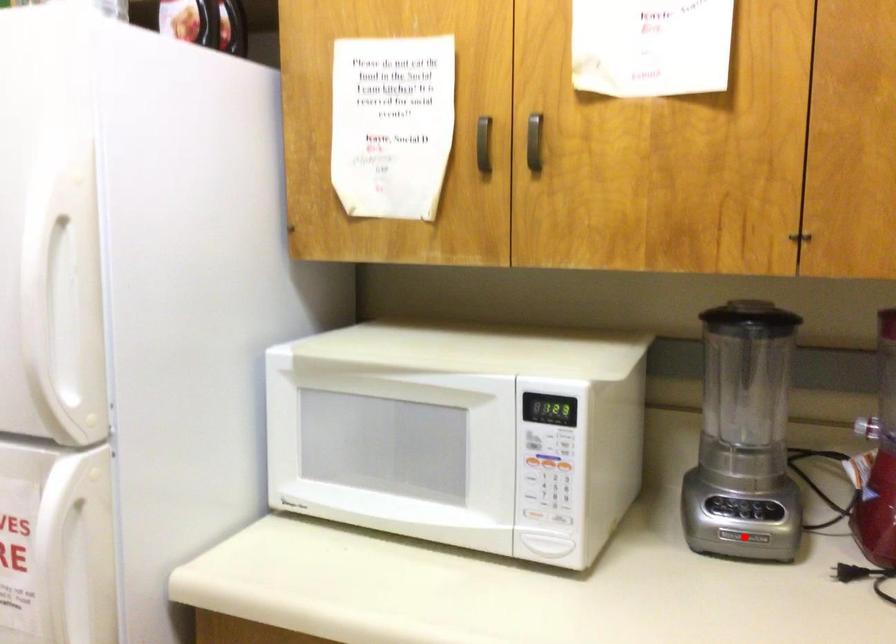
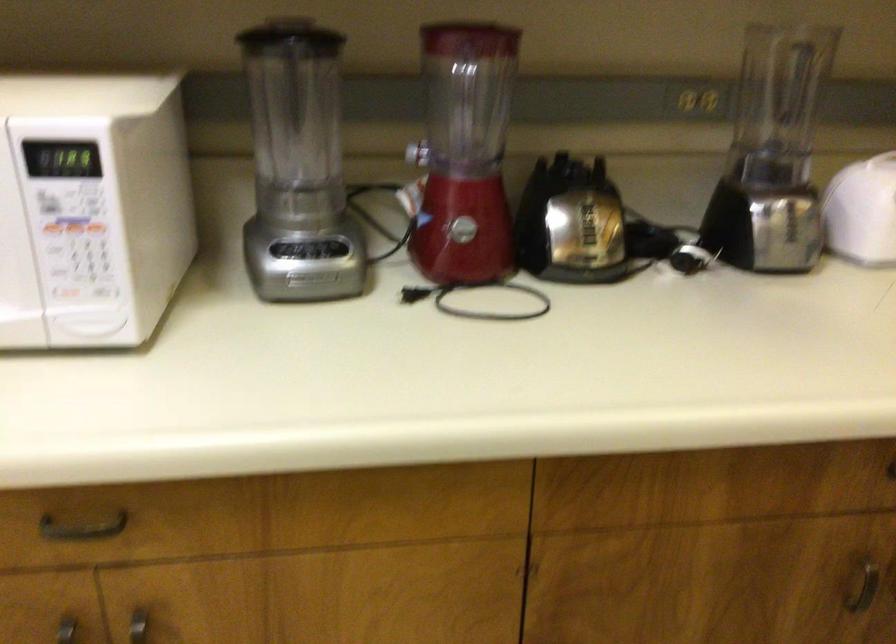
Find the pixel in the second image that matches the highlighted location in the first image.

(309, 278)